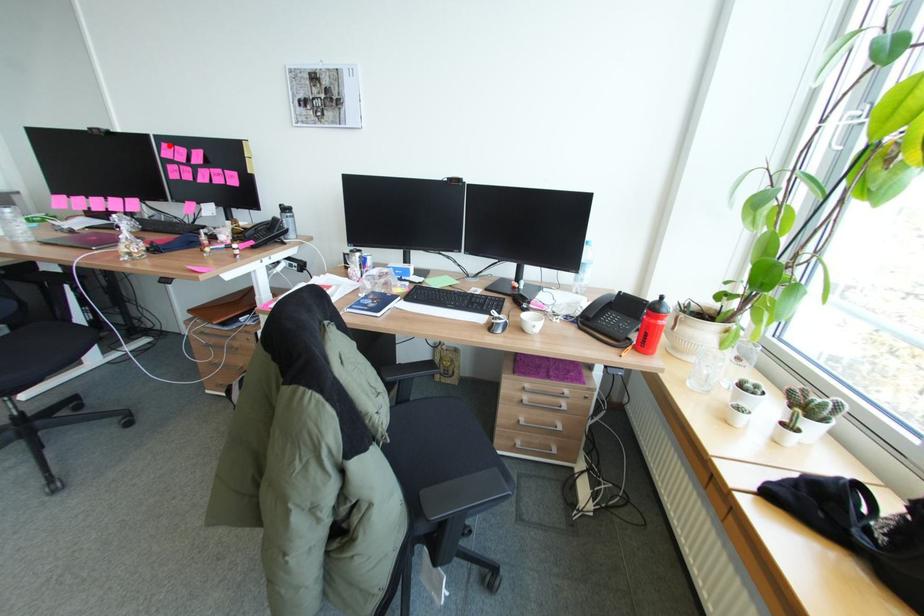
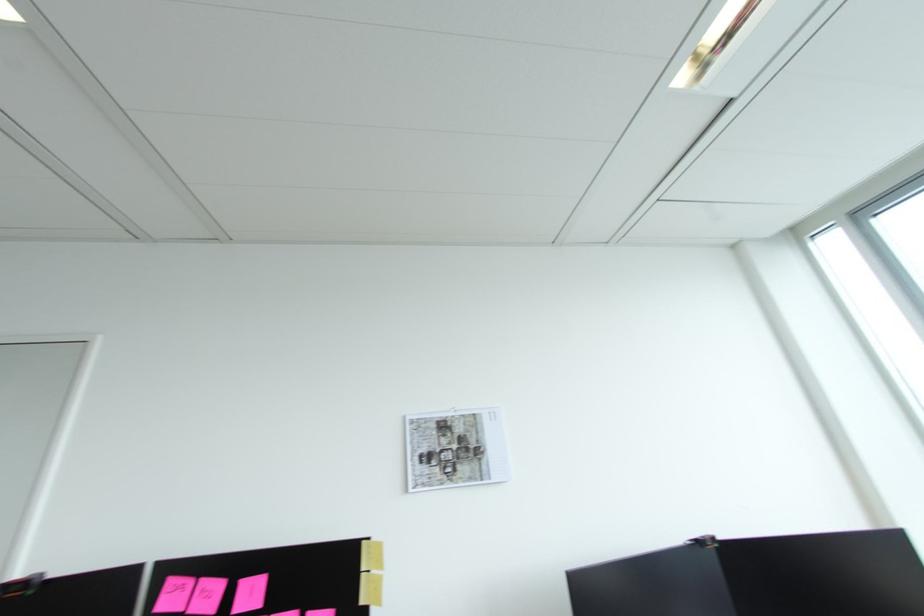
Question: I am providing you with two images of the same scene from different viewpoints. A red point is shown in image1. For the corresponding object point in image2, is it positioned nearer or farther from the camera?

Choices:
 (A) Nearer
 (B) Farther

Answer: (A)